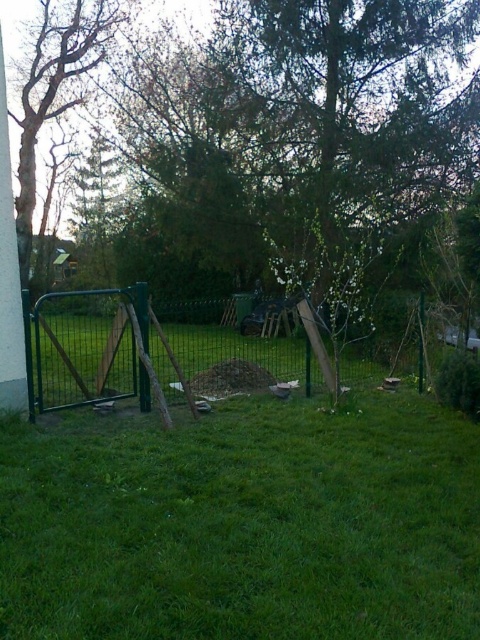
Is green metal fence at left taller than smooth bark tree at left?

Indeed, green metal fence at left has a greater height compared to smooth bark tree at left.

Between green metal fence at left and smooth bark tree at left, which one has less height?

With less height is smooth bark tree at left.

Describe the element at coordinates (170, 352) in the screenshot. The height and width of the screenshot is (640, 480). I see `green metal fence at left` at that location.

Find the location of `green metal fence at left`. green metal fence at left is located at coordinates (170, 352).